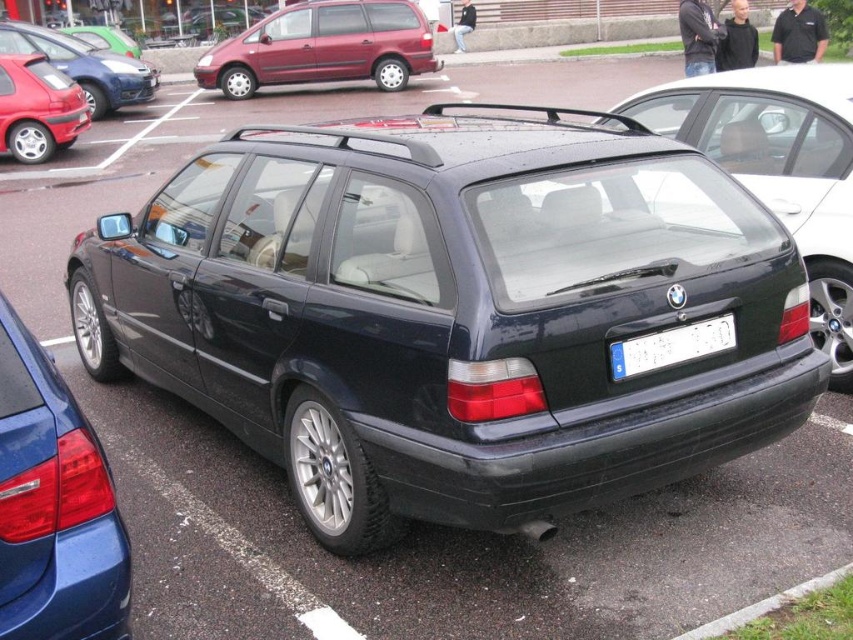
You are a delivery person trying to park your delivery van next to the maroon metallic minivan at center and the gray concrete curb at lower right. Based on their sizes, which object is narrower and can fit between two other parked cars?

The maroon metallic minivan at center is thinner than the gray concrete curb at lower right, so it can fit between two other parked cars more easily.

You are a parking attendant trying to fit a new car into the parking spot next to the satin black car at center. The new car is the same size as the glossy blue car at lower left. Will the new car fit in the available space?

The glossy blue car at lower left is smaller than the satin black car at center, so the new car, being the same size as the glossy blue car at lower left, will fit in the available space.